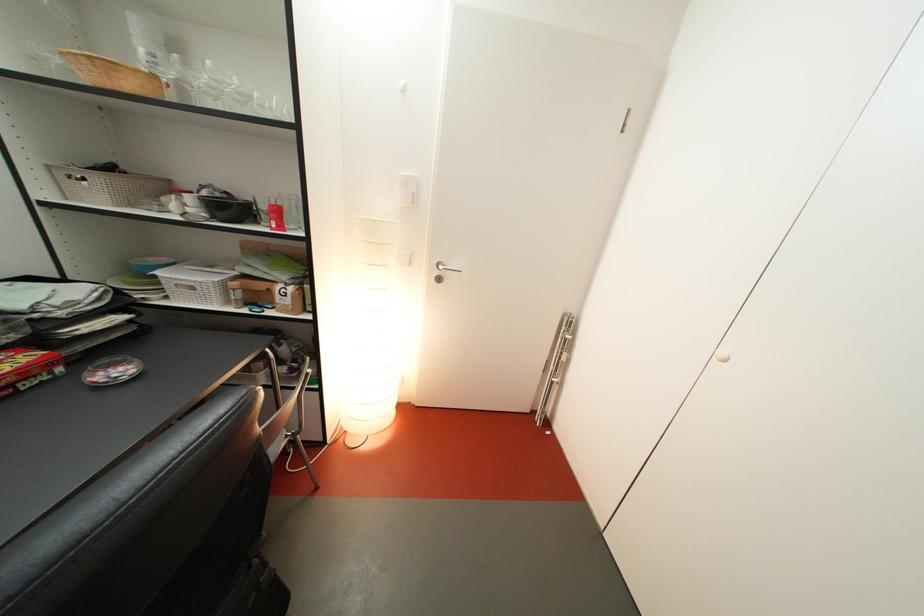
You are a GUI agent. You are given a task and a screenshot of the screen. Output one action in this format:
    pyautogui.click(x=<x>, y=<y>)
    Task: Click on the red game box
    The image size is (924, 616).
    Given the screenshot: What is the action you would take?
    pyautogui.click(x=27, y=369)